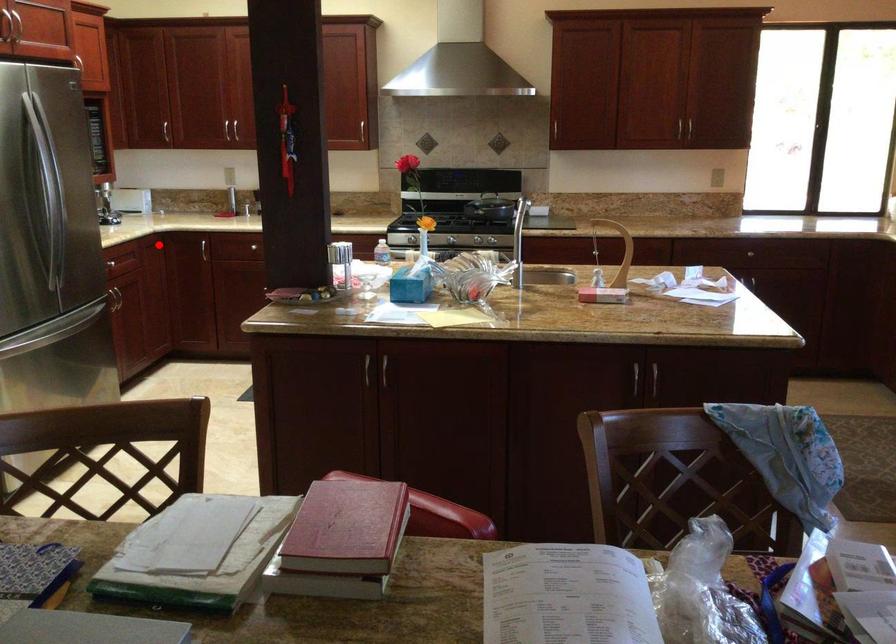
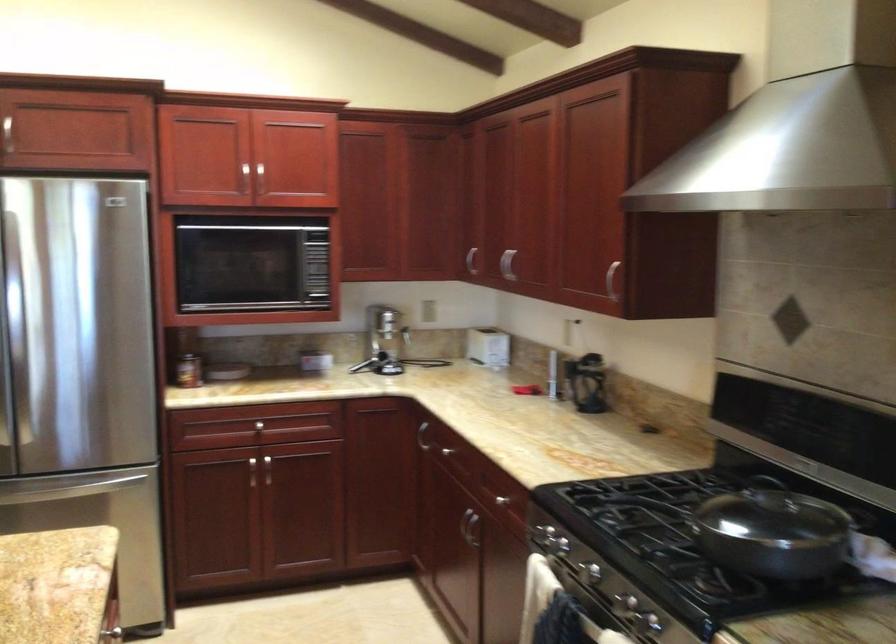
Question: I am providing you with two images of the same scene from different viewpoints. Image1 has a red point marked. In image2, the corresponding 3D location appears at what relative position? Reply with the corresponding letter.

Choices:
 (A) Closer
 (B) Farther

Answer: (A)